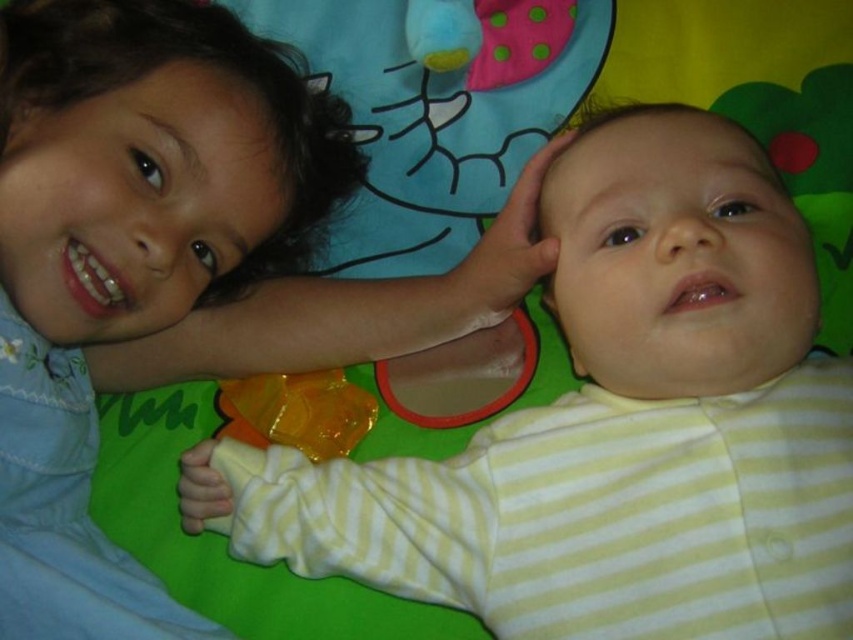
Question: Among these points, which one is nearest to the camera?

Choices:
 (A) (695, 397)
 (B) (192, 3)

Answer: (A)

Question: Which point appears closest to the camera in this image?

Choices:
 (A) (564, 326)
 (B) (267, 257)
 (C) (329, 397)

Answer: (A)

Question: Can you confirm if matte blue shirt at upper left is wider than yellow striped onesie at center?

Choices:
 (A) no
 (B) yes

Answer: (A)

Question: Which object appears farthest from the camera in this image?

Choices:
 (A) matte blue shirt at upper left
 (B) yellow striped onesie at center
 (C) translucent orange pacifier at lower center

Answer: (C)

Question: Can you confirm if yellow striped onesie at center is positioned below translucent orange pacifier at lower center?

Choices:
 (A) no
 (B) yes

Answer: (B)

Question: Is matte blue shirt at upper left below yellow striped onesie at center?

Choices:
 (A) yes
 (B) no

Answer: (B)